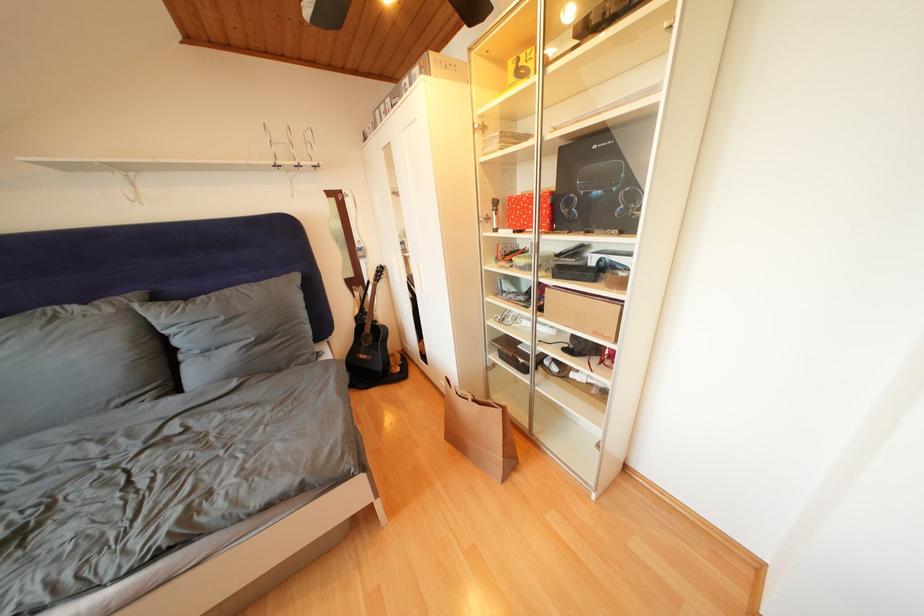
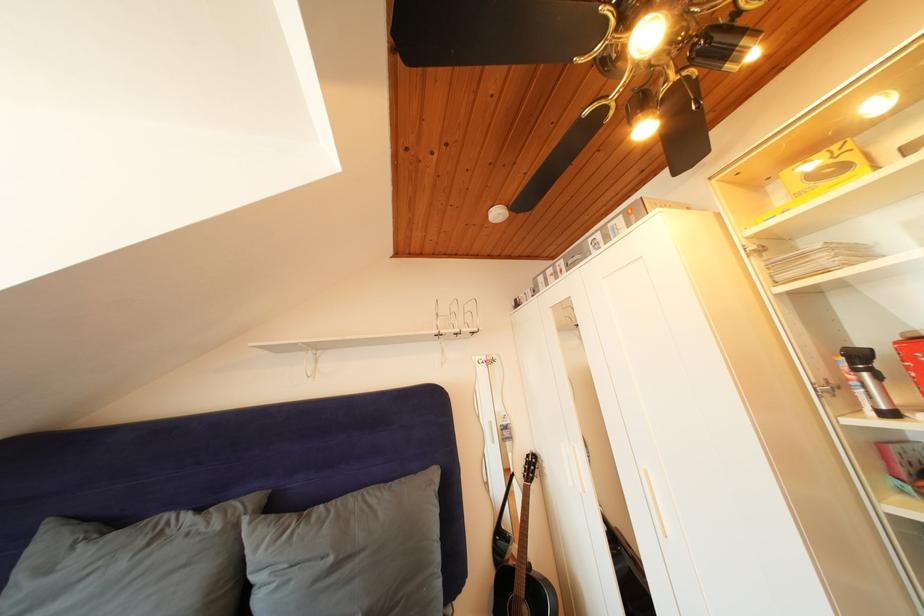
Find the pixel in the second image that matches [117,315] in the first image.

(225, 531)